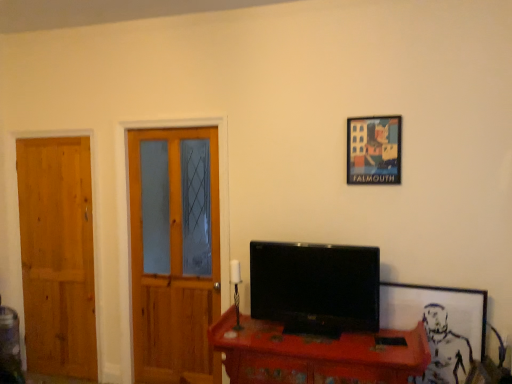
Describe the element at coordinates (174, 253) in the screenshot. I see `wooden door at left, the 2th door in the left-to-right sequence` at that location.

Image resolution: width=512 pixels, height=384 pixels. What do you see at coordinates (374, 150) in the screenshot? I see `matte plastic picture frame at upper right, the second picture frame positioned from the right` at bounding box center [374, 150].

This screenshot has height=384, width=512. What do you see at coordinates (315, 354) in the screenshot?
I see `wooden desk at center` at bounding box center [315, 354].

This screenshot has width=512, height=384. What are the coordinates of `white matte picture frame at right, the second picture frame positioned from the top` in the screenshot? It's located at (436, 305).

How much space does white matte picture frame at right, positioned as the 1th picture frame in right-to-left order, occupy horizontally?

The width of white matte picture frame at right, positioned as the 1th picture frame in right-to-left order, is 2.75 inches.

At what (x,y) coordinates should I click in order to perform the action: click on natural wood door at left, placed as the first door when sorted from left to right. Please return your answer as a coordinate pair (x, y). Looking at the image, I should click on (57, 255).

What do you see at coordinates (57, 255) in the screenshot? The height and width of the screenshot is (384, 512). I see `natural wood door at left, the 2th door when ordered from right to left` at bounding box center [57, 255].

Locate an element on the screen. This screenshot has width=512, height=384. wooden door at left, the 2th door in the left-to-right sequence is located at coordinates (174, 253).

Consider the image. Who is taller, natural wood door at left, the 2th door when ordered from right to left, or black glossy tv at center?

natural wood door at left, the 2th door when ordered from right to left.

From the image's perspective, does natural wood door at left, placed as the first door when sorted from left to right, appear lower than black glossy tv at center?

Actually, natural wood door at left, placed as the first door when sorted from left to right, appears above black glossy tv at center in the image.

From a real-world perspective, which is physically above, natural wood door at left, the 2th door when ordered from right to left, or black glossy tv at center?

From a 3D spatial view, natural wood door at left, the 2th door when ordered from right to left, is above.

Considering the relative sizes of natural wood door at left, the 2th door when ordered from right to left, and black glossy tv at center in the image provided, is natural wood door at left, the 2th door when ordered from right to left, thinner than black glossy tv at center?

Correct, the width of natural wood door at left, the 2th door when ordered from right to left, is less than that of black glossy tv at center.

Considering the positions of objects matte plastic picture frame at upper right, the second picture frame positioned from the right, and wooden desk at center in the image provided, who is more to the right, matte plastic picture frame at upper right, the second picture frame positioned from the right, or wooden desk at center?

matte plastic picture frame at upper right, the second picture frame positioned from the right.

Between matte plastic picture frame at upper right, the second picture frame positioned from the right, and wooden desk at center, which one is positioned behind?

matte plastic picture frame at upper right, the second picture frame positioned from the right, is behind.

Consider the image. Is matte plastic picture frame at upper right, which is the 2th picture frame from bottom to top, facing towards wooden desk at center?

No, matte plastic picture frame at upper right, which is the 2th picture frame from bottom to top, is not facing towards wooden desk at center.

In the scene shown: Looking at the image, does matte plastic picture frame at upper right, which is the 2th picture frame from bottom to top, seem bigger or smaller compared to wooden desk at center?

In the image, matte plastic picture frame at upper right, which is the 2th picture frame from bottom to top, appears to be smaller than wooden desk at center.

Is white matte picture frame at right, the second picture frame positioned from the top, turned away from wooden desk at center?

No, white matte picture frame at right, the second picture frame positioned from the top,'s orientation is not away from wooden desk at center.

Considering the relative sizes of white matte picture frame at right, which is counted as the first picture frame, starting from the bottom, and wooden desk at center in the image provided, is white matte picture frame at right, which is counted as the first picture frame, starting from the bottom, thinner than wooden desk at center?

Yes, white matte picture frame at right, which is counted as the first picture frame, starting from the bottom, is thinner than wooden desk at center.

Which object is further away from the camera, white matte picture frame at right, which is counted as the first picture frame, starting from the bottom, or wooden desk at center?

white matte picture frame at right, which is counted as the first picture frame, starting from the bottom, is further from the camera.

Is wooden door at left, the 2th door in the left-to-right sequence, not inside black glossy tv at center?

Yes, wooden door at left, the 2th door in the left-to-right sequence, is located beyond the bounds of black glossy tv at center.

From their relative heights in the image, would you say wooden door at left, the 2th door in the left-to-right sequence, is taller or shorter than black glossy tv at center?

Considering their sizes, wooden door at left, the 2th door in the left-to-right sequence, has more height than black glossy tv at center.

From the picture: Is wooden door at left, placed as the first door when sorted from right to left, thinner than black glossy tv at center?

Yes.

From the image's perspective, relative to wooden door at left, the 2th door in the left-to-right sequence, is natural wood door at left, placed as the first door when sorted from left to right, above or below?

natural wood door at left, placed as the first door when sorted from left to right, is situated lower than wooden door at left, the 2th door in the left-to-right sequence, in the image.

How different are the orientations of natural wood door at left, placed as the first door when sorted from left to right, and wooden door at left, the 2th door in the left-to-right sequence, in degrees?

There is a 0.692-degree angle between the facing directions of natural wood door at left, placed as the first door when sorted from left to right, and wooden door at left, the 2th door in the left-to-right sequence.

Considering their positions, is natural wood door at left, placed as the first door when sorted from left to right, located in front of or behind wooden door at left, placed as the first door when sorted from right to left?

Clearly, natural wood door at left, placed as the first door when sorted from left to right, is behind wooden door at left, placed as the first door when sorted from right to left.

Is point (46, 366) farther from viewer compared to point (194, 146)?

That is True.

Is wooden door at left, placed as the first door when sorted from right to left, facing away from wooden desk at center?

No, wooden door at left, placed as the first door when sorted from right to left,'s orientation is not away from wooden desk at center.

Looking at this image, is the depth of wooden door at left, the 2th door in the left-to-right sequence, greater than that of wooden desk at center?

Yes, the depth of wooden door at left, the 2th door in the left-to-right sequence, is greater than that of wooden desk at center.

Is point (170, 270) closer or farther from the camera than point (306, 345)?

Point (170, 270) is positioned farther from the camera compared to point (306, 345).

In terms of height, does black glossy tv at center look taller or shorter compared to natural wood door at left, the 2th door when ordered from right to left?

black glossy tv at center is shorter than natural wood door at left, the 2th door when ordered from right to left.

Does point (321, 278) come behind point (57, 272)?

No, it is in front of (57, 272).

Are black glossy tv at center and natural wood door at left, the 2th door when ordered from right to left, located far from each other?

Absolutely, black glossy tv at center is distant from natural wood door at left, the 2th door when ordered from right to left.

Find the location of a particular element. The height and width of the screenshot is (384, 512). the 1st door above the black glossy tv at center (from a real-world perspective) is located at coordinates (57, 255).

The image size is (512, 384). Identify the location of television below the natural wood door at left, placed as the first door when sorted from left to right (from the image's perspective). (315, 287).

Locate an element on the screen. The image size is (512, 384). the 2nd picture frame behind the wooden desk at center is located at coordinates (374, 150).

From the image, which object appears to be nearer to natural wood door at left, placed as the first door when sorted from left to right, wooden desk at center or wooden door at left, the 2th door in the left-to-right sequence?

Among the two, wooden door at left, the 2th door in the left-to-right sequence, is located nearer to natural wood door at left, placed as the first door when sorted from left to right.

Looking at the image, which one is located further to black glossy tv at center, natural wood door at left, placed as the first door when sorted from left to right, or white matte picture frame at right, placed as the second picture frame when sorted from left to right?

Based on the image, natural wood door at left, placed as the first door when sorted from left to right, appears to be further to black glossy tv at center.

Based on their spatial positions, is wooden desk at center or black glossy tv at center closer to matte plastic picture frame at upper right, which is the 2th picture frame from bottom to top?

black glossy tv at center is closer to matte plastic picture frame at upper right, which is the 2th picture frame from bottom to top.

Which object lies nearer to the anchor point wooden door at left, the 2th door in the left-to-right sequence, white matte picture frame at right, placed as the second picture frame when sorted from left to right, or natural wood door at left, the 2th door when ordered from right to left?

natural wood door at left, the 2th door when ordered from right to left, is closer to wooden door at left, the 2th door in the left-to-right sequence.

When comparing their distances from white matte picture frame at right, the second picture frame positioned from the top, does matte plastic picture frame at upper right, the second picture frame positioned from the right, or wooden desk at center seem further?

matte plastic picture frame at upper right, the second picture frame positioned from the right.

Considering their positions, is matte plastic picture frame at upper right, positioned as the 1th picture frame in top-to-bottom order, positioned closer to wooden door at left, placed as the first door when sorted from right to left, than white matte picture frame at right, positioned as the 1th picture frame in right-to-left order?

Based on the image, matte plastic picture frame at upper right, positioned as the 1th picture frame in top-to-bottom order, appears to be nearer to wooden door at left, placed as the first door when sorted from right to left.

Estimate the real-world distances between objects in this image. Which object is closer to natural wood door at left, the 2th door when ordered from right to left, matte plastic picture frame at upper right, positioned as the 1th picture frame in top-to-bottom order, or wooden door at left, the 2th door in the left-to-right sequence?

wooden door at left, the 2th door in the left-to-right sequence, lies closer to natural wood door at left, the 2th door when ordered from right to left, than the other object.

Estimate the real-world distances between objects in this image. Which object is closer to wooden desk at center, wooden door at left, the 2th door in the left-to-right sequence, or black glossy tv at center?

black glossy tv at center is closer to wooden desk at center.

Where is `television that lies between matte plastic picture frame at upper right, marked as the 1th picture frame in a left-to-right arrangement, and wooden desk at center from top to bottom`? television that lies between matte plastic picture frame at upper right, marked as the 1th picture frame in a left-to-right arrangement, and wooden desk at center from top to bottom is located at coordinates (315, 287).

This screenshot has width=512, height=384. I want to click on television between natural wood door at left, placed as the first door when sorted from left to right, and white matte picture frame at right, placed as the second picture frame when sorted from left to right, so click(x=315, y=287).

You are a GUI agent. You are given a task and a screenshot of the screen. Output one action in this format:
    pyautogui.click(x=<x>, y=<y>)
    Task: Click on the desk located between natural wood door at left, the 2th door when ordered from right to left, and matte plastic picture frame at upper right, the second picture frame positioned from the right, in the left-right direction
    Image resolution: width=512 pixels, height=384 pixels.
    Given the screenshot: What is the action you would take?
    pyautogui.click(x=315, y=354)

Locate an element on the screen. picture frame located between wooden door at left, the 2th door in the left-to-right sequence, and white matte picture frame at right, positioned as the 1th picture frame in right-to-left order, in the left-right direction is located at coordinates (374, 150).